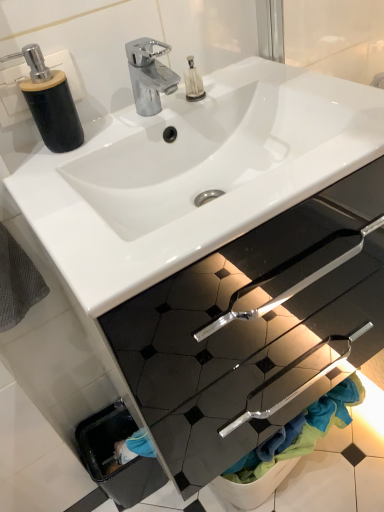
Question: Is gray textured towel at lower left next to white glossy sink at center and touching it?

Choices:
 (A) no
 (B) yes

Answer: (A)

Question: Is the position of gray textured towel at lower left less distant than that of white glossy sink at center?

Choices:
 (A) no
 (B) yes

Answer: (A)

Question: Is gray textured towel at lower left further to camera compared to white glossy sink at center?

Choices:
 (A) no
 (B) yes

Answer: (B)

Question: Considering the relative positions of gray textured towel at lower left and white glossy sink at center in the image provided, is gray textured towel at lower left to the right of white glossy sink at center from the viewer's perspective?

Choices:
 (A) yes
 (B) no

Answer: (B)

Question: Is gray textured towel at lower left not near white glossy sink at center?

Choices:
 (A) yes
 (B) no

Answer: (B)

Question: Is gray textured towel at lower left at the left side of white glossy sink at center?

Choices:
 (A) yes
 (B) no

Answer: (A)

Question: Is matte black soap dispenser at upper left oriented away from gray textured towel at lower left?

Choices:
 (A) yes
 (B) no

Answer: (B)

Question: From a real-world perspective, does matte black soap dispenser at upper left stand above gray textured towel at lower left?

Choices:
 (A) yes
 (B) no

Answer: (A)

Question: Considering the relative sizes of matte black soap dispenser at upper left and gray textured towel at lower left in the image provided, is matte black soap dispenser at upper left bigger than gray textured towel at lower left?

Choices:
 (A) yes
 (B) no

Answer: (B)

Question: Considering the relative sizes of matte black soap dispenser at upper left and gray textured towel at lower left in the image provided, is matte black soap dispenser at upper left shorter than gray textured towel at lower left?

Choices:
 (A) no
 (B) yes

Answer: (B)

Question: Could you tell me if matte black soap dispenser at upper left is turned towards gray textured towel at lower left?

Choices:
 (A) yes
 (B) no

Answer: (B)

Question: Considering the relative sizes of matte black soap dispenser at upper left and gray textured towel at lower left in the image provided, is matte black soap dispenser at upper left thinner than gray textured towel at lower left?

Choices:
 (A) no
 (B) yes

Answer: (B)

Question: Is matte black soap dispenser at upper left placed right next to white glossy sink at center?

Choices:
 (A) yes
 (B) no

Answer: (B)